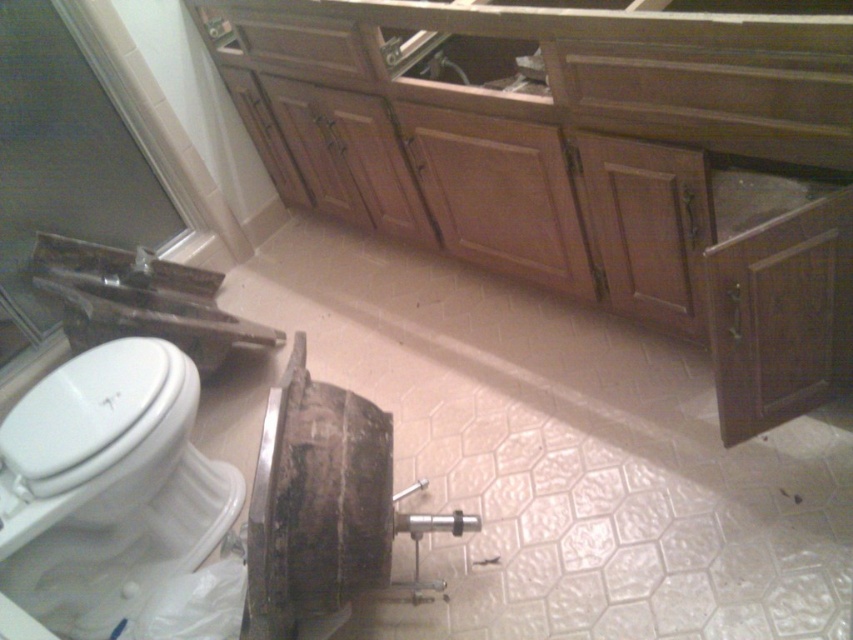
Is wooden cabinet at center shorter than white glossy toilet bowl at lower left?

No.

Who is positioned more to the right, wooden cabinet at center or white glossy toilet bowl at lower left?

From the viewer's perspective, wooden cabinet at center appears more on the right side.

What do you see at coordinates (584, 157) in the screenshot? The image size is (853, 640). I see `wooden cabinet at center` at bounding box center [584, 157].

This screenshot has height=640, width=853. Identify the location of wooden cabinet at center. (584, 157).

Is point (643, 1) farther from camera compared to point (137, 275)?

That is False.

Looking at this image, does wooden cabinet at center lie behind metallic silver sink at left?

No, it is in front of metallic silver sink at left.

The width and height of the screenshot is (853, 640). Identify the location of wooden cabinet at center. (584, 157).

Can you confirm if white glossy toilet bowl at lower left is positioned above metallic silver sink at left?

No, white glossy toilet bowl at lower left is not above metallic silver sink at left.

Who is shorter, white glossy toilet bowl at lower left or metallic silver sink at left?

metallic silver sink at left is shorter.

Which is in front, point (99, 541) or point (138, 282)?

Point (99, 541) is more forward.

Where is `white glossy toilet bowl at lower left`? The height and width of the screenshot is (640, 853). white glossy toilet bowl at lower left is located at coordinates (107, 486).